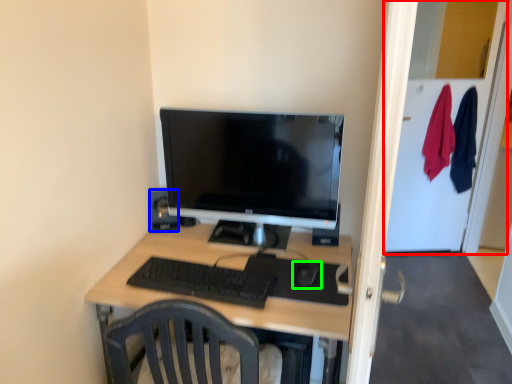
Question: Estimate the real-world distances between objects in this image. Which object is farther from glass door (highlighted by a red box), speaker (highlighted by a blue box) or mouse (highlighted by a green box)?

Choices:
 (A) speaker
 (B) mouse

Answer: (A)